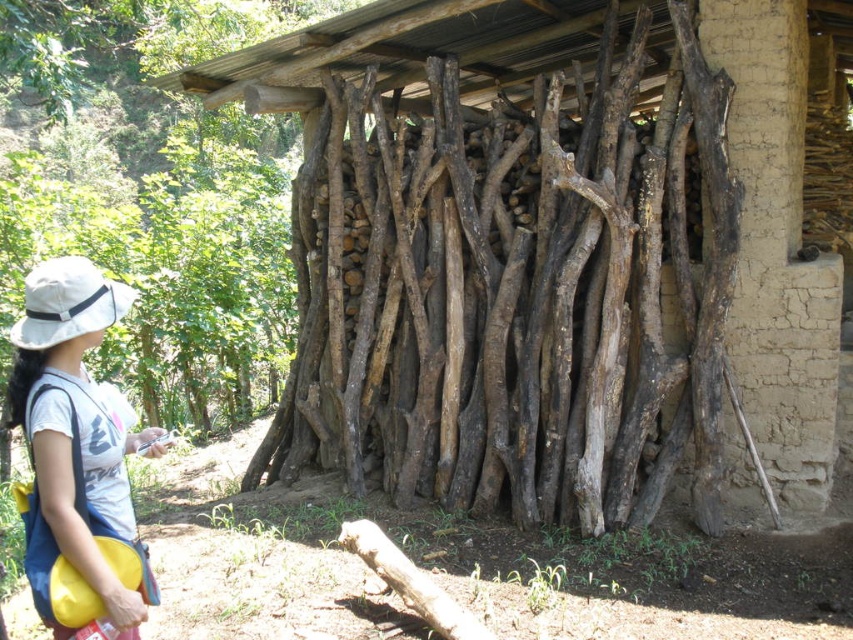
Question: Does brown rough wood at center appear over white fabric hat at left?

Choices:
 (A) no
 (B) yes

Answer: (B)

Question: Which object is closer to the camera taking this photo?

Choices:
 (A) brown rough wood at center
 (B) white fabric hat at left

Answer: (B)

Question: Which object is closer to the camera taking this photo?

Choices:
 (A) brown rough wood at center
 (B) white fabric hat at left

Answer: (B)

Question: Which point is closer to the camera taking this photo?

Choices:
 (A) (466, 369)
 (B) (65, 262)

Answer: (B)

Question: From the image, what is the correct spatial relationship of brown rough wood at center in relation to white fabric hat at left?

Choices:
 (A) right
 (B) left

Answer: (A)

Question: Does brown rough wood at center appear on the left side of white fabric hat at left?

Choices:
 (A) no
 (B) yes

Answer: (A)